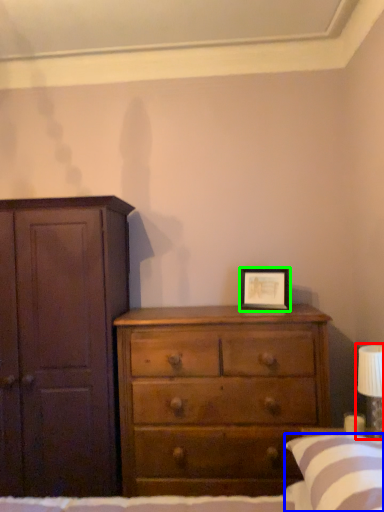
Question: Based on their relative distances, which object is farther from bedside lamp (highlighted by a red box)? Choose from pillow (highlighted by a blue box) and picture frame (highlighted by a green box).

Choices:
 (A) pillow
 (B) picture frame

Answer: (B)